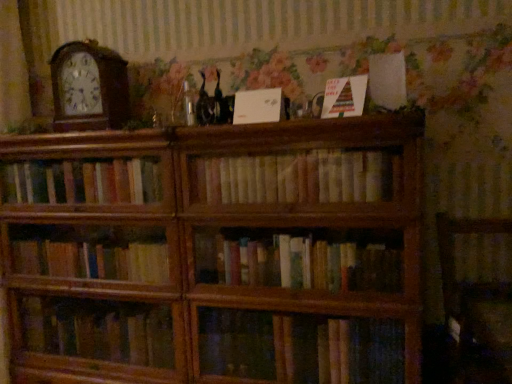
Question: From a real-world perspective, relative to wooden armchair at lower right, is wooden clock at left vertically above or below?

Choices:
 (A) above
 (B) below

Answer: (A)

Question: Is wooden clock at left in front of or behind wooden armchair at lower right in the image?

Choices:
 (A) front
 (B) behind

Answer: (B)

Question: Based on their relative distances, which object is farther from the wooden bookcase at center?

Choices:
 (A) white matte paper at upper center, the first paperback book in the left-to-right sequence
 (B) light brown wood bookshelf at center
 (C) wooden armchair at lower right
 (D) multicolored paper at upper center, marked as the 2th paperback book in a left-to-right arrangement
 (E) wooden clock at left

Answer: (C)

Question: Based on their relative distances, which object is farther from the light brown wood bookshelf at center?

Choices:
 (A) wooden armchair at lower right
 (B) multicolored paper at upper center, marked as the 2th paperback book in a left-to-right arrangement
 (C) wooden clock at left
 (D) white matte paper at upper center, which is counted as the 2th paperback book, starting from the right
 (E) wooden bookcase at center

Answer: (C)